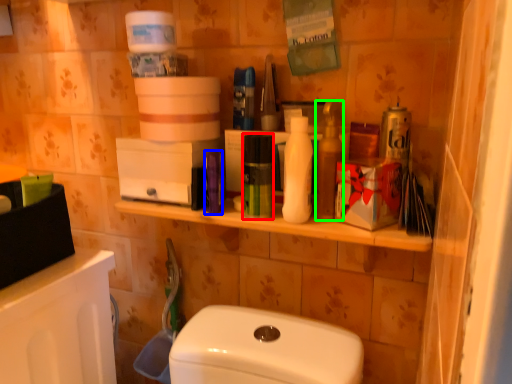
Question: Based on their relative distances, which object is nearer to mouthwash (highlighted by a red box)? Choose from toiletry (highlighted by a blue box) and cleaning product (highlighted by a green box).

Choices:
 (A) toiletry
 (B) cleaning product

Answer: (A)